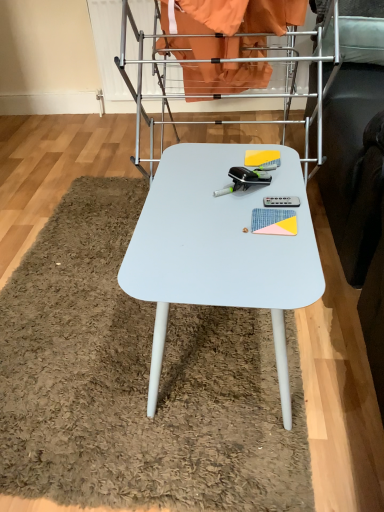
Question: Is metallic silver drying rack at center positioned behind white matte table at center?

Choices:
 (A) no
 (B) yes

Answer: (B)

Question: From a real-world perspective, is metallic silver drying rack at center positioned over white matte table at center based on gravity?

Choices:
 (A) yes
 (B) no

Answer: (A)

Question: Considering the relative sizes of metallic silver drying rack at center and white matte table at center in the image provided, is metallic silver drying rack at center wider than white matte table at center?

Choices:
 (A) yes
 (B) no

Answer: (A)

Question: Does metallic silver drying rack at center appear on the left side of white matte table at center?

Choices:
 (A) yes
 (B) no

Answer: (B)

Question: Considering the relative positions of metallic silver drying rack at center and white matte table at center in the image provided, is metallic silver drying rack at center to the right of white matte table at center from the viewer's perspective?

Choices:
 (A) no
 (B) yes

Answer: (B)

Question: Are metallic silver drying rack at center and white matte table at center beside each other?

Choices:
 (A) no
 (B) yes

Answer: (A)

Question: Does white matte table at center have a greater width compared to metallic silver drying rack at center?

Choices:
 (A) yes
 (B) no

Answer: (B)

Question: From the image's perspective, is white matte table at center on metallic silver drying rack at center?

Choices:
 (A) no
 (B) yes

Answer: (A)

Question: Is the depth of white matte table at center less than that of metallic silver drying rack at center?

Choices:
 (A) yes
 (B) no

Answer: (A)

Question: Are white matte table at center and metallic silver drying rack at center making contact?

Choices:
 (A) no
 (B) yes

Answer: (A)

Question: From a real-world perspective, is white matte table at center located beneath metallic silver drying rack at center?

Choices:
 (A) no
 (B) yes

Answer: (B)

Question: Is white matte table at center bigger than metallic silver drying rack at center?

Choices:
 (A) no
 (B) yes

Answer: (A)

Question: Is metallic silver drying rack at center wider or thinner than white matte table at center?

Choices:
 (A) wide
 (B) thin

Answer: (A)